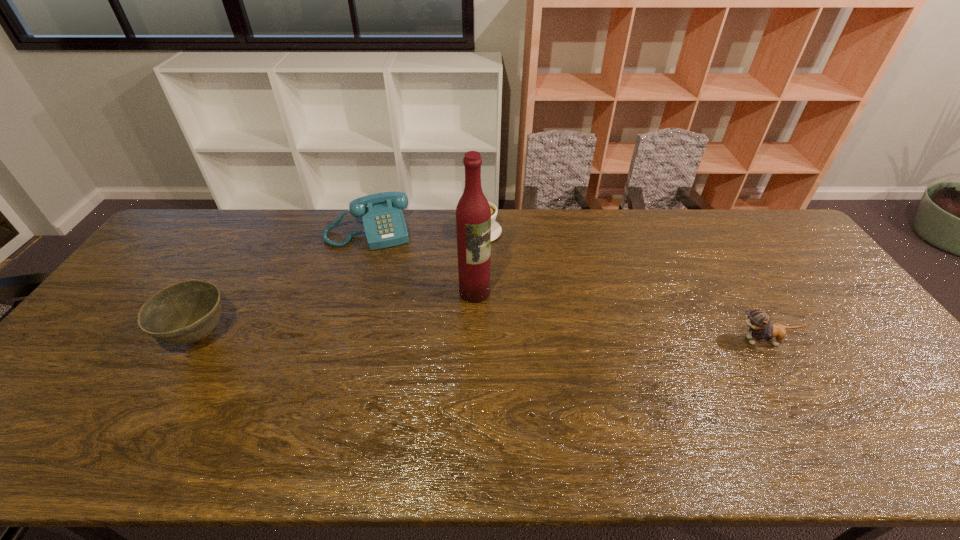
The image size is (960, 540). In order to click on vacant space on the desktop that is between the leftmost object and the kitten and is positioned to the right of the cappuccino's handle in this screenshot , I will do `click(464, 338)`.

At what (x,y) coordinates should I click in order to perform the action: click on free spot on the desktop that is between the leftmost object and the kitten and is positioned on the label of the liquor. Please return your answer as a coordinate pair (x, y). The width and height of the screenshot is (960, 540). Looking at the image, I should click on (533, 339).

Identify the location of vacant spot on the desktop that is between the leftmost object and the kitten and is positioned on the dial of the telephone. (396, 338).